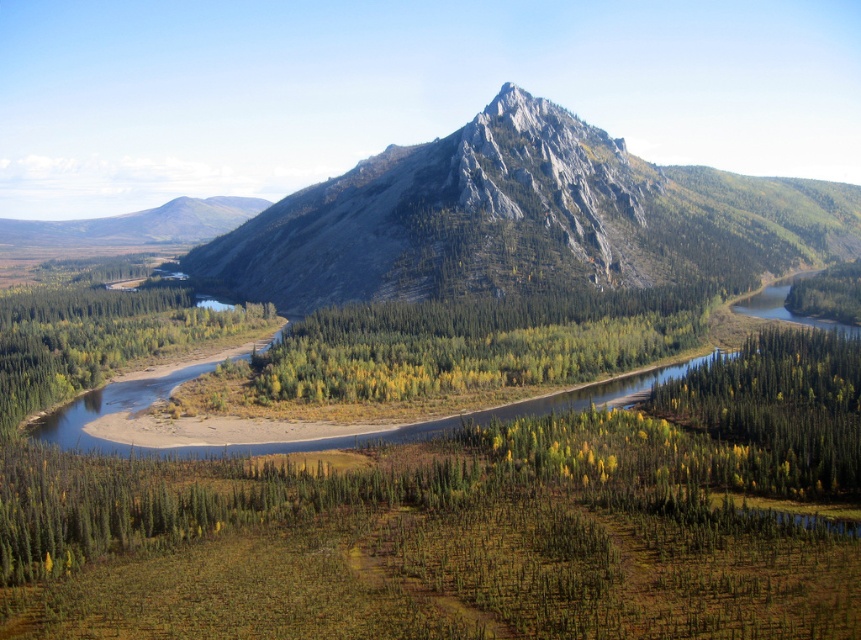
You are a hiker planning to cross from the rugged gray rock at center to the green leafy forest at center. Given that your average walking pace is 1.5 meters per second, how long will it take you to reach the forest?

The rugged gray rock at center is 76.89 meters away from the green leafy forest at center. At a pace of 1.5 meters per second, it would take approximately 51.26 seconds to reach the forest.

You are a hiker planning to take a photo of the rugged gray rock at center and the green matte tree at lower right from a viewpoint. Which object will appear larger in your photo?

The rugged gray rock at center will appear larger in the photo because it is much taller than the green matte tree at lower right.